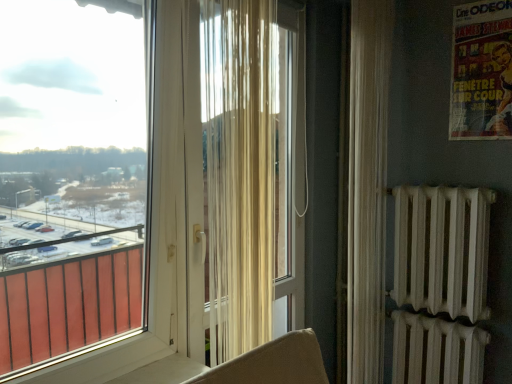
Question: Considering the positions of point (95, 190) and point (481, 38), is point (95, 190) closer or farther from the camera than point (481, 38)?

Choices:
 (A) farther
 (B) closer

Answer: (B)

Question: From the image's perspective, relative to matte paper poster at upper right, is transparent plastic window at upper left above or below?

Choices:
 (A) below
 (B) above

Answer: (A)

Question: Which of these objects is positioned closest to the sheer white curtain at center, acting as the first curtain starting from the left?

Choices:
 (A) transparent plastic window at upper left
 (B) matte paper poster at upper right
 (C) sheer white curtain at right, the 1th curtain positioned from the right

Answer: (A)

Question: Which object is the farthest from the sheer white curtain at center, the second curtain from the right?

Choices:
 (A) matte paper poster at upper right
 (B) sheer white curtain at right, which appears as the second curtain when viewed from the left
 (C) transparent plastic window at upper left

Answer: (A)